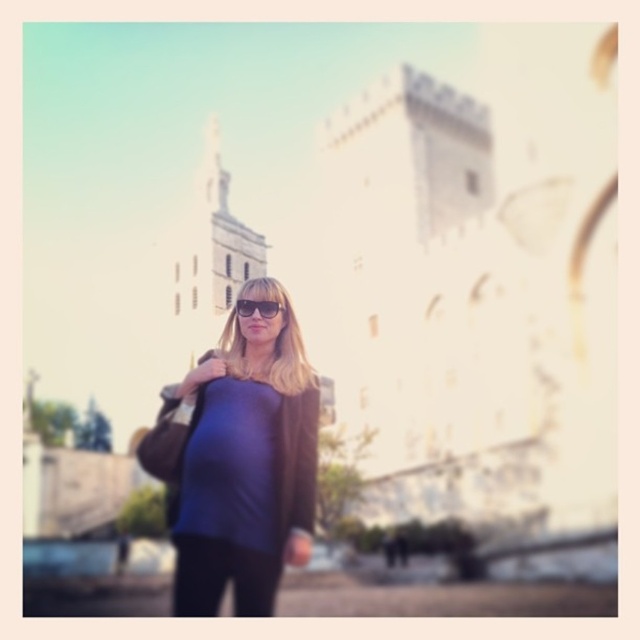
Question: Which point is farther from the camera taking this photo?

Choices:
 (A) (243, 307)
 (B) (193, 561)

Answer: (A)

Question: Is matte blue shirt at center bigger than matte black sunglasses at center?

Choices:
 (A) no
 (B) yes

Answer: (B)

Question: Which object is closer to the camera taking this photo?

Choices:
 (A) matte black sunglasses at center
 (B) matte blue shirt at center

Answer: (B)

Question: Can you confirm if matte blue shirt at center is smaller than matte black sunglasses at center?

Choices:
 (A) yes
 (B) no

Answer: (B)

Question: Does matte blue shirt at center have a lesser width compared to matte black sunglasses at center?

Choices:
 (A) no
 (B) yes

Answer: (A)